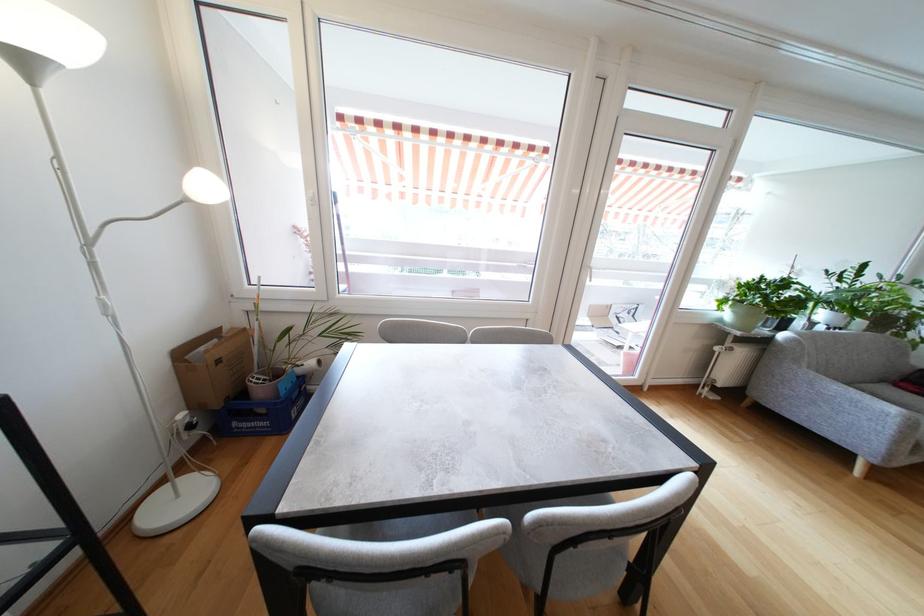
At what (x,y) coordinates should I click in order to perform the action: click on blue plastic crate. Please return your answer as a coordinate pair (x, y). This screenshot has height=616, width=924. Looking at the image, I should click on (261, 413).